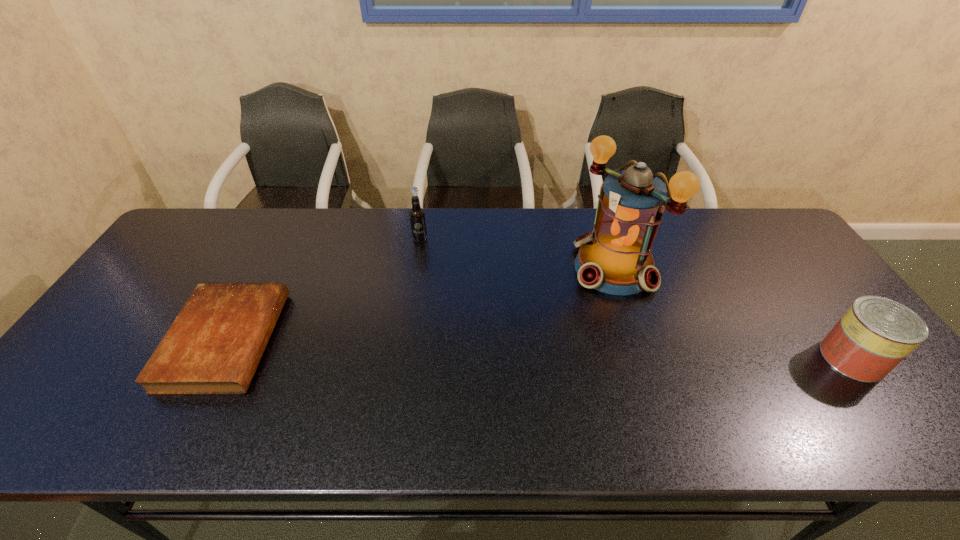
This screenshot has width=960, height=540. Identify the location of object situated at the right edge. (875, 334).

I want to click on object that is at the near right corner, so click(x=875, y=334).

At what (x,y) coordinates should I click in order to perform the action: click on vacant space at the far edge of the desktop. Please return your answer as a coordinate pair (x, y). Image resolution: width=960 pixels, height=540 pixels. Looking at the image, I should click on (305, 235).

Where is `vacant space at the near edge of the desktop`? This screenshot has width=960, height=540. vacant space at the near edge of the desktop is located at coordinates (373, 374).

Where is `vacant space at the left edge of the desktop`? vacant space at the left edge of the desktop is located at coordinates (161, 327).

The width and height of the screenshot is (960, 540). Identify the location of vacant space at the far left corner of the desktop. (233, 217).

This screenshot has width=960, height=540. Identify the location of free location at the far right corner. (762, 214).

The width and height of the screenshot is (960, 540). I want to click on free spot between the shortest object and the root beer, so click(x=323, y=289).

Find the location of `empty location between the second object from left to right and the shortest object`. empty location between the second object from left to right and the shortest object is located at coordinates (323, 289).

The width and height of the screenshot is (960, 540). I want to click on vacant area that lies between the third object from right to left and the can, so click(x=636, y=299).